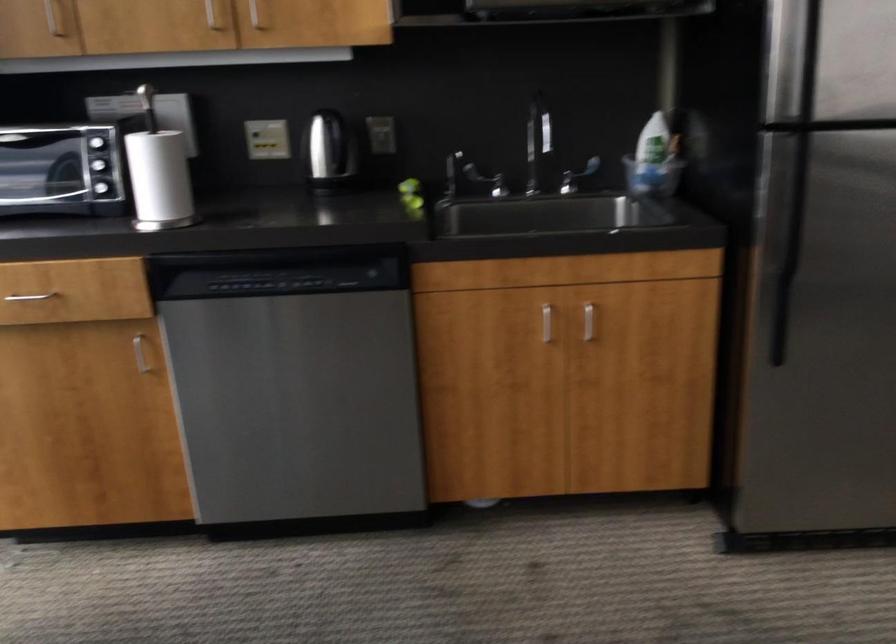
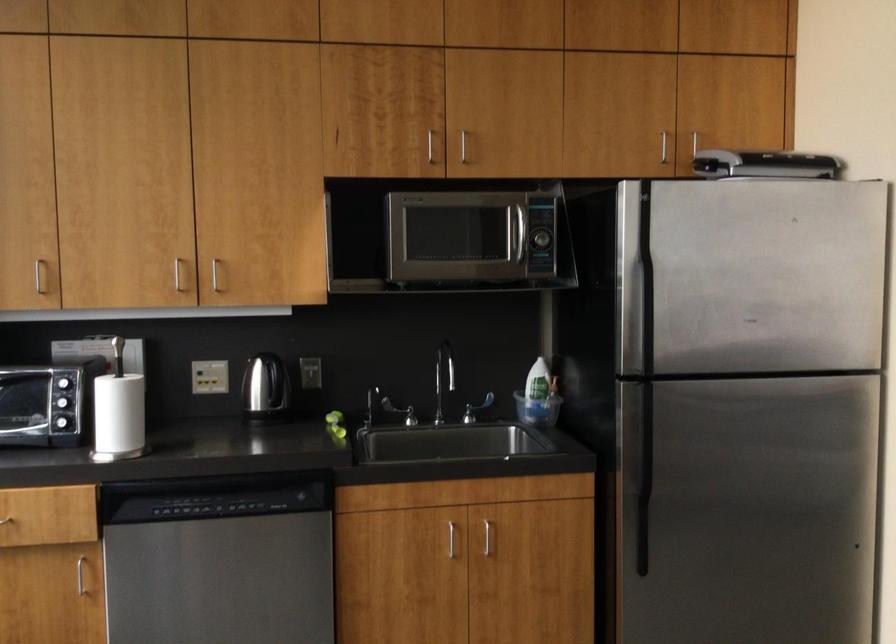
Locate, in the second image, the point that corresponds to point (157, 178) in the first image.

(117, 415)